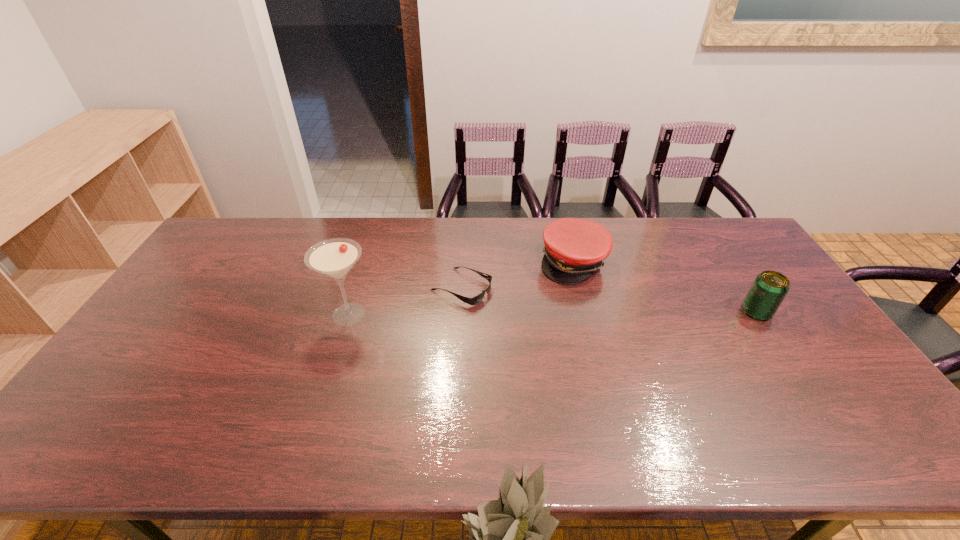
In the image, there is a desktop. Where is `free space at the near right corner`? free space at the near right corner is located at coordinates (816, 402).

The image size is (960, 540). I want to click on vacant area between the third object from right to left and the tallest object, so click(x=405, y=301).

In order to click on vacant point located between the rightmost object and the cap in this screenshot , I will do `click(665, 287)`.

Identify the location of empty space that is in between the second object from right to left and the shortest object. The height and width of the screenshot is (540, 960). (517, 274).

At what (x,y) coordinates should I click in order to perform the action: click on vacant space that is in between the third object from left to right and the sunglasses. Please return your answer as a coordinate pair (x, y). Looking at the image, I should click on (517, 274).

Where is `vacant region between the rightmost object and the third object from left to right`? vacant region between the rightmost object and the third object from left to right is located at coordinates (665, 287).

The width and height of the screenshot is (960, 540). What are the coordinates of `free spot between the sunglasses and the third object from left to right` in the screenshot? It's located at (517, 274).

At what (x,y) coordinates should I click in order to perform the action: click on blank region between the leftmost object and the third object from left to right. Please return your answer as a coordinate pair (x, y). The width and height of the screenshot is (960, 540). Looking at the image, I should click on coord(462,288).

You are a GUI agent. You are given a task and a screenshot of the screen. Output one action in this format:
    pyautogui.click(x=<x>, y=<y>)
    Task: Click on the vacant region between the third object from left to right and the rightmost object
    
    Given the screenshot: What is the action you would take?
    pyautogui.click(x=665, y=287)

In order to click on free space that is in between the beer can and the leftmost object in this screenshot , I will do `click(553, 313)`.